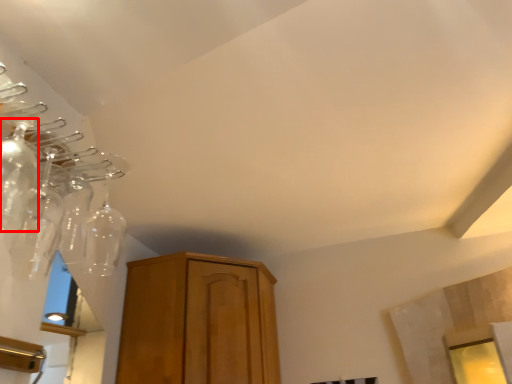
Question: From the image's perspective, what is the correct spatial relationship of glass bottle (annotated by the red box) in relation to glass bottle?

Choices:
 (A) above
 (B) below

Answer: (A)